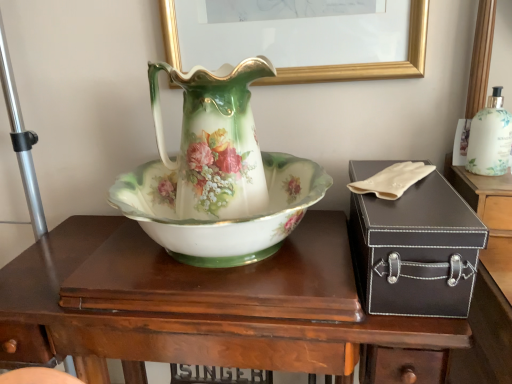
Question: In the image, is black leather suitcase at right positioned in front of or behind white glossy bottle at upper right?

Choices:
 (A) front
 (B) behind

Answer: (A)

Question: From the image's perspective, is black leather suitcase at right positioned above or below white glossy bottle at upper right?

Choices:
 (A) above
 (B) below

Answer: (B)

Question: Considering the real-world distances, which object is closest to the porcelain floral bowl at center?

Choices:
 (A) black leather suitcase at right
 (B) porcelain floral vase at center
 (C) wooden desk at center
 (D) white glossy bottle at upper right

Answer: (B)

Question: Based on their relative distances, which object is nearer to the porcelain floral bowl at center?

Choices:
 (A) porcelain floral vase at center
 (B) wooden desk at center
 (C) black leather suitcase at right
 (D) white glossy bottle at upper right

Answer: (A)